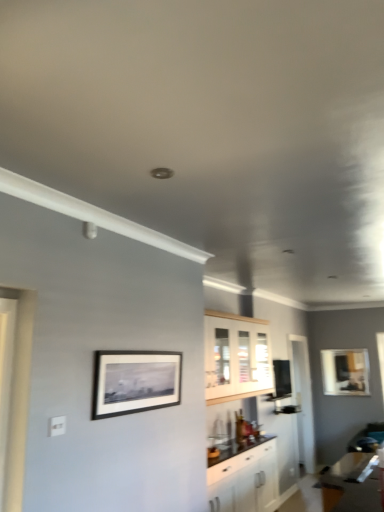
Question: Is transparent glass door at center not inside matte black picture frame at upper right, acting as the first picture frame starting from the back?

Choices:
 (A) no
 (B) yes

Answer: (B)

Question: Is transparent glass door at center bigger than matte black picture frame at upper right, the 2th picture frame viewed from the front?

Choices:
 (A) no
 (B) yes

Answer: (B)

Question: From the image's perspective, is transparent glass door at center below matte black picture frame at upper right, which appears as the 1th picture frame when viewed from the right?

Choices:
 (A) yes
 (B) no

Answer: (A)

Question: Considering the relative sizes of transparent glass door at center and matte black picture frame at upper right, which ranks as the 1th picture frame in bottom-to-top order, in the image provided, is transparent glass door at center smaller than matte black picture frame at upper right, which ranks as the 1th picture frame in bottom-to-top order,?

Choices:
 (A) no
 (B) yes

Answer: (A)

Question: Is transparent glass door at center thinner than matte black picture frame at upper right, acting as the first picture frame starting from the back?

Choices:
 (A) yes
 (B) no

Answer: (B)

Question: From a real-world perspective, is matte black picture frame at upper right, acting as the first picture frame starting from the back, positioned above or below white wood cabinet at center, positioned as the 2th cabinetry in bottom-to-top order?

Choices:
 (A) above
 (B) below

Answer: (B)

Question: From the image's perspective, is matte black picture frame at upper right, which ranks as the 1th picture frame in bottom-to-top order, positioned above or below white wood cabinet at center, positioned as the 2th cabinetry in bottom-to-top order?

Choices:
 (A) above
 (B) below

Answer: (B)

Question: In terms of width, does matte black picture frame at upper right, which ranks as the 1th picture frame in bottom-to-top order, look wider or thinner when compared to white wood cabinet at center, positioned as the 1th cabinetry in top-to-bottom order?

Choices:
 (A) wide
 (B) thin

Answer: (B)

Question: In terms of height, does matte black picture frame at upper right, which appears as the 1th picture frame when viewed from the right, look taller or shorter compared to white wood cabinet at center, positioned as the 1th cabinetry in top-to-bottom order?

Choices:
 (A) tall
 (B) short

Answer: (B)

Question: Considering the positions of point (304, 336) and point (233, 485), is point (304, 336) closer or farther from the camera than point (233, 485)?

Choices:
 (A) farther
 (B) closer

Answer: (A)

Question: Is transparent glass door at center wider or thinner than white glossy cabinet at center, the 1th cabinetry from the bottom?

Choices:
 (A) wide
 (B) thin

Answer: (B)

Question: Considering the positions of transparent glass door at center and white glossy cabinet at center, acting as the second cabinetry starting from the top, in the image, is transparent glass door at center taller or shorter than white glossy cabinet at center, acting as the second cabinetry starting from the top,?

Choices:
 (A) short
 (B) tall

Answer: (B)

Question: Would you say transparent glass door at center is to the left or to the right of white glossy cabinet at center, acting as the second cabinetry starting from the top, in the picture?

Choices:
 (A) right
 (B) left

Answer: (A)

Question: Considering the positions of point (301, 413) and point (135, 377), is point (301, 413) closer or farther from the camera than point (135, 377)?

Choices:
 (A) farther
 (B) closer

Answer: (A)

Question: From the image's perspective, is transparent glass door at center above or below black matte picture frame at upper center, which ranks as the 2th picture frame in right-to-left order?

Choices:
 (A) below
 (B) above

Answer: (A)